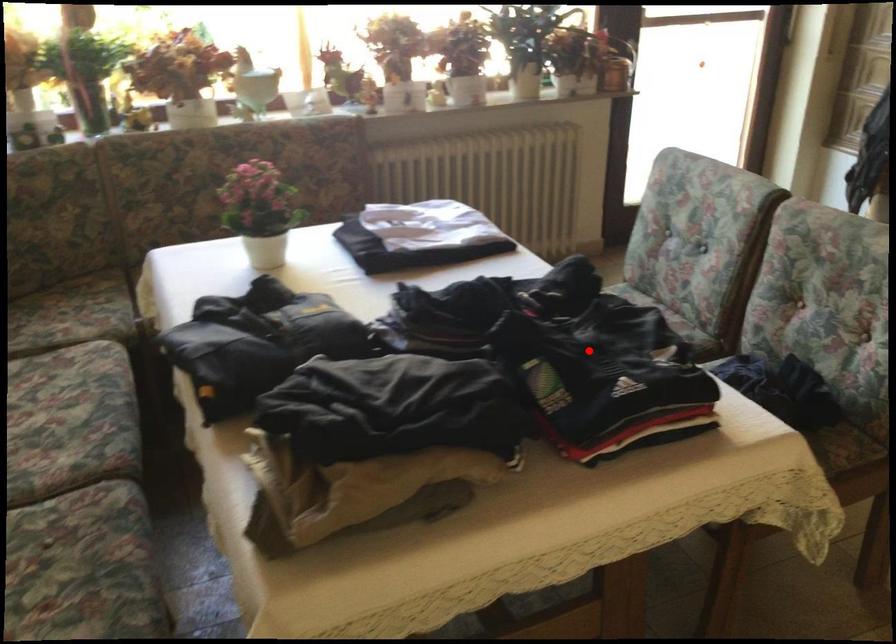
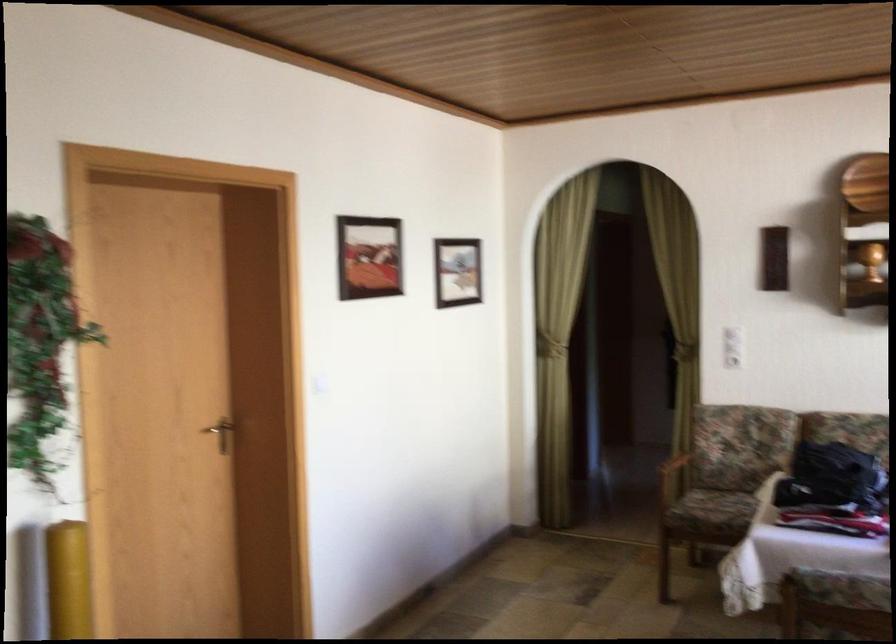
Question: I am providing you with two images of the same scene from different viewpoints. In image1, a red point is highlighted. Considering the same 3D point in image2, which of the following is correct?

Choices:
 (A) It is closer
 (B) It is farther

Answer: (B)